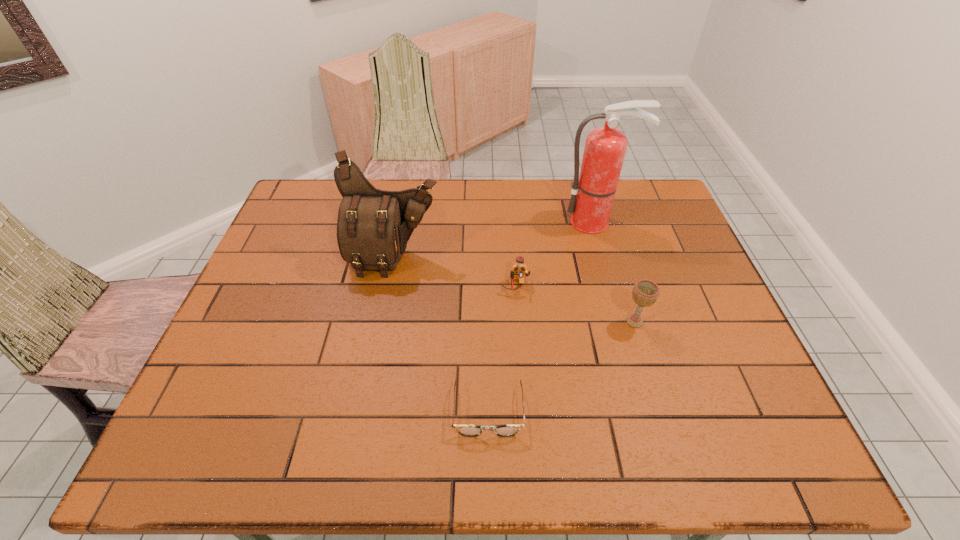
Find the location of `fire extinguisher`. fire extinguisher is located at coordinates (593, 191).

In order to click on the farthest object in this screenshot , I will do `click(593, 191)`.

In order to click on shoulder bag in this screenshot , I will do `click(373, 227)`.

Locate an element on the screen. Image resolution: width=960 pixels, height=540 pixels. the leftmost object is located at coordinates (373, 227).

Where is `the third tallest object`? This screenshot has width=960, height=540. the third tallest object is located at coordinates (645, 292).

I want to click on chalice, so pos(645,292).

Find the location of `the fourth tallest object`. the fourth tallest object is located at coordinates (519, 269).

The width and height of the screenshot is (960, 540). I want to click on the shortest object, so click(x=465, y=430).

The image size is (960, 540). What are the coordinates of `the nearest object` in the screenshot? It's located at (465, 430).

The image size is (960, 540). In order to click on vacant space located 0.090m with the handle and hose on the farthest object in this screenshot , I will do `click(604, 254)`.